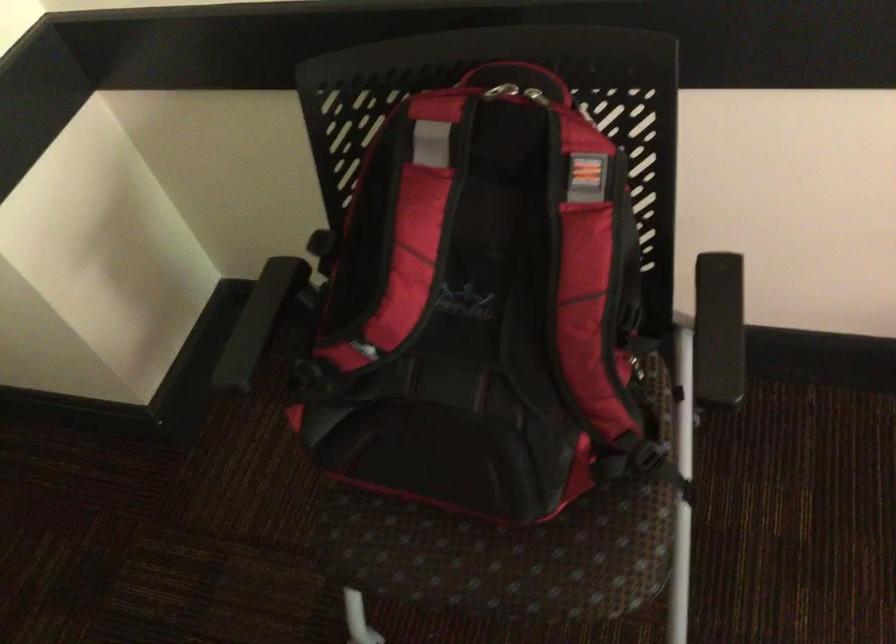
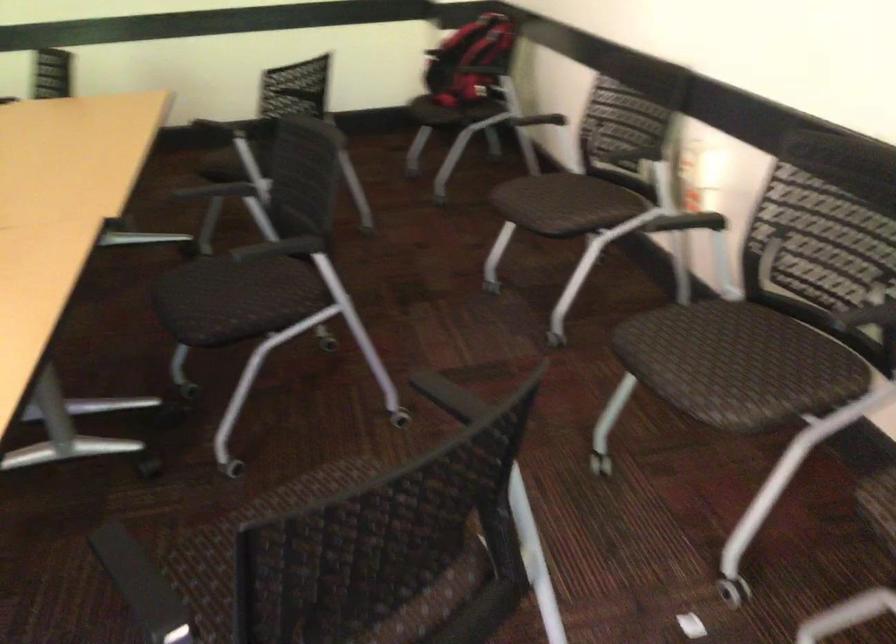
Locate, in the second image, the point that corresponds to point (616, 325) in the first image.

(471, 61)